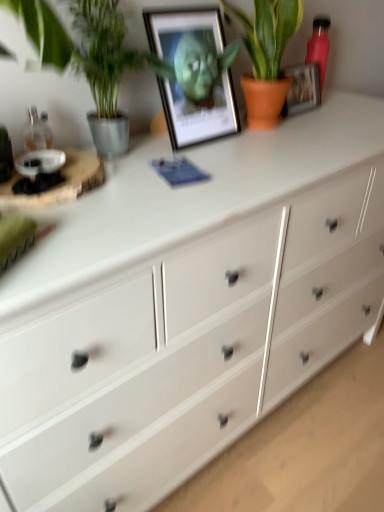
Locate an element on the screen. This screenshot has width=384, height=512. free space in front of terracotta pot plant at upper center, the 2th houseplant when ordered from left to right is located at coordinates (x=255, y=147).